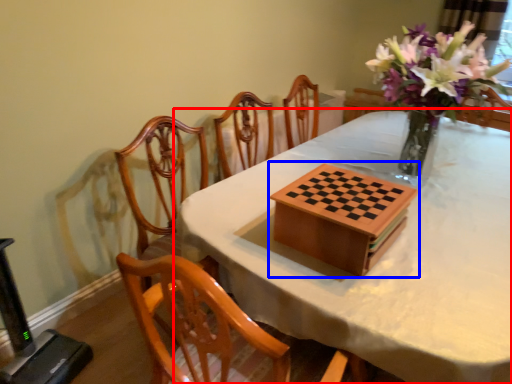
Question: Among these objects, which one is farthest to the camera, table (highlighted by a red box) or board game (highlighted by a blue box)?

Choices:
 (A) table
 (B) board game

Answer: (B)